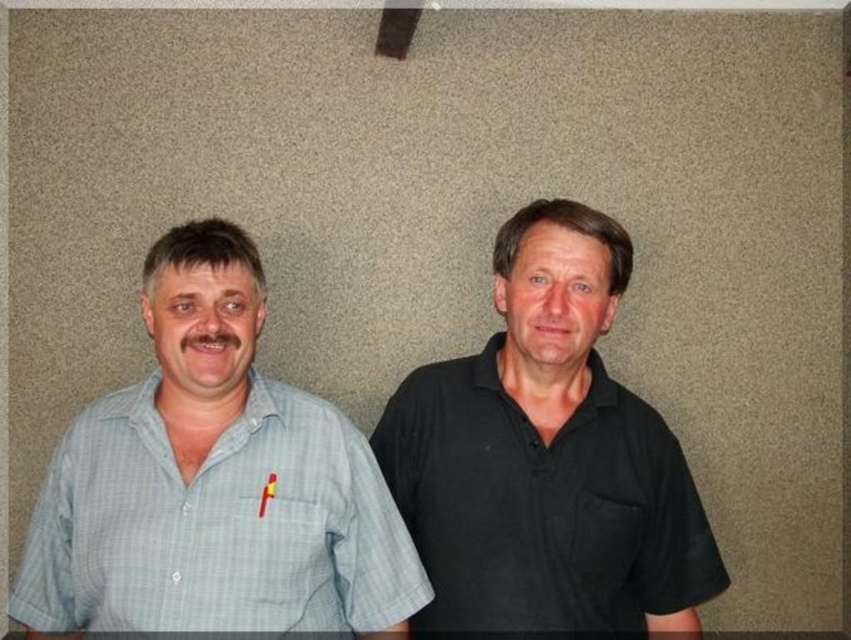
Does point (501, 376) come closer to viewer compared to point (306, 522)?

No, it is behind (306, 522).

Between black smooth shirt at right and light blue checkered shirt at left, which one has more height?

With more height is black smooth shirt at right.

Is point (665, 545) less distant than point (54, 604)?

No.

This screenshot has width=851, height=640. Find the location of `black smooth shirt at right`. black smooth shirt at right is located at coordinates (546, 456).